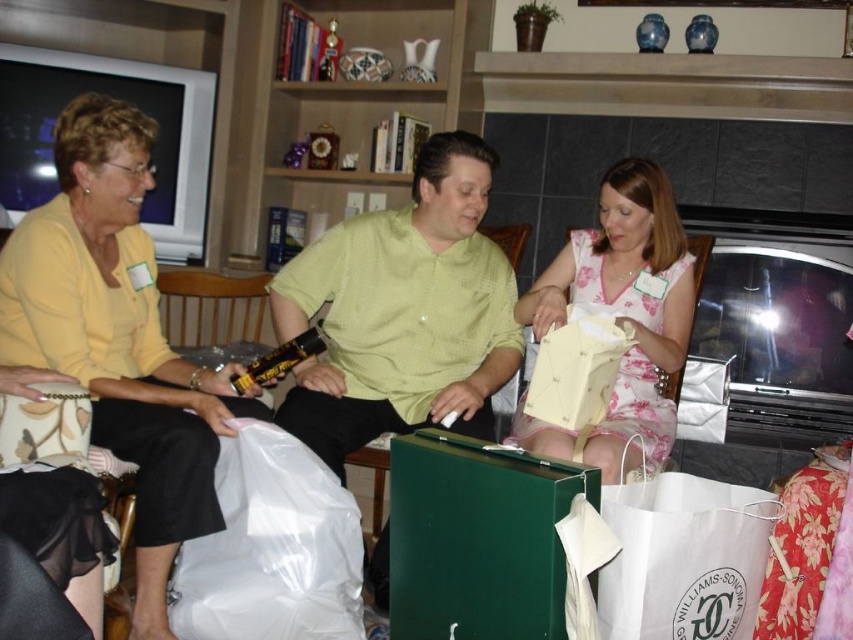
Does yellow matte shirt at upper left appear on the left side of floral fabric dress at center?

Indeed, yellow matte shirt at upper left is positioned on the left side of floral fabric dress at center.

Which is below, yellow matte shirt at upper left or floral fabric dress at center?

yellow matte shirt at upper left

Does point (158, 381) lie in front of point (619, 429)?

No, it is not.

Where is `yellow matte shirt at upper left`? yellow matte shirt at upper left is located at coordinates (119, 337).

Is point (289, 484) positioned in front of point (670, 532)?

No.

Which is more to the left, transparent plastic bag at lower left or white paper shopping bag at lower right?

transparent plastic bag at lower left is more to the left.

Between point (293, 493) and point (740, 577), which one is positioned behind?

Point (293, 493)

I want to click on transparent plastic bag at lower left, so click(271, 547).

Who is lower down, yellow matte shirt at upper left or transparent plastic bag at lower left?

Positioned lower is transparent plastic bag at lower left.

Is yellow matte shirt at upper left taller than transparent plastic bag at lower left?

Yes.

Where is `yellow matte shirt at upper left`? This screenshot has height=640, width=853. yellow matte shirt at upper left is located at coordinates (119, 337).